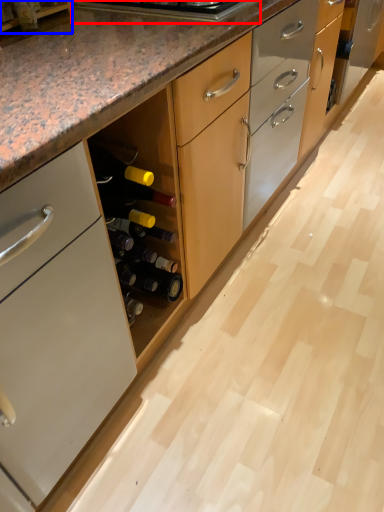
Question: Which of the following is the farthest to the observer, appliance (highlighted by a red box) or shelf (highlighted by a blue box)?

Choices:
 (A) appliance
 (B) shelf

Answer: (A)